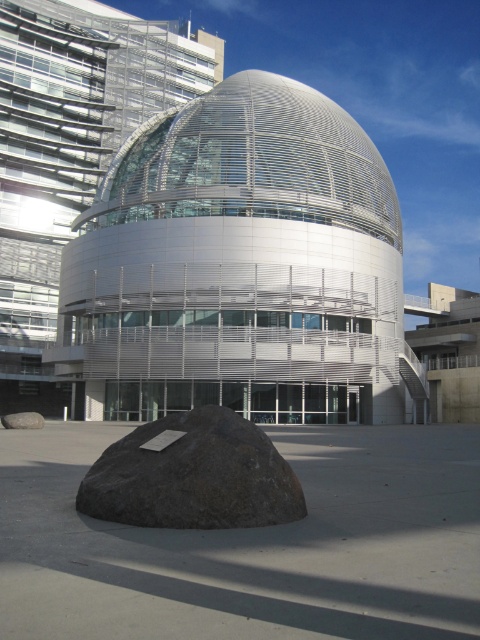
Measure the distance between white metallic dome at center and camera.

A distance of 37.88 meters exists between white metallic dome at center and camera.

Does white metallic dome at center lie behind gray rough rock at lower center?

Yes, it is.

Is point (131, 164) closer to camera compared to point (44, 422)?

No, (131, 164) is behind (44, 422).

You are a GUI agent. You are given a task and a screenshot of the screen. Output one action in this format:
    pyautogui.click(x=<x>, y=<y>)
    Task: Click on the white metallic dome at center
    Image resolution: width=480 pixels, height=640 pixels.
    Given the screenshot: What is the action you would take?
    pyautogui.click(x=252, y=163)

Can you confirm if white metallic dome at center is positioned below dark gray stone boulder at lower center?

No.

Does white metallic dome at center have a larger size compared to dark gray stone boulder at lower center?

Indeed, white metallic dome at center has a larger size compared to dark gray stone boulder at lower center.

Does point (237, 83) come in front of point (229, 458)?

No, (237, 83) is behind (229, 458).

The height and width of the screenshot is (640, 480). Identify the location of white metallic dome at center. (252, 163).

From the picture: Is dark gray stone boulder at lower center smaller than gray rough rock at lower center?

Yes.

Is dark gray stone boulder at lower center thinner than gray rough rock at lower center?

Yes.

Does point (189, 451) come closer to viewer compared to point (39, 419)?

Yes, point (189, 451) is in front of point (39, 419).

The width and height of the screenshot is (480, 640). What are the coordinates of `dark gray stone boulder at lower center` in the screenshot? It's located at (192, 476).